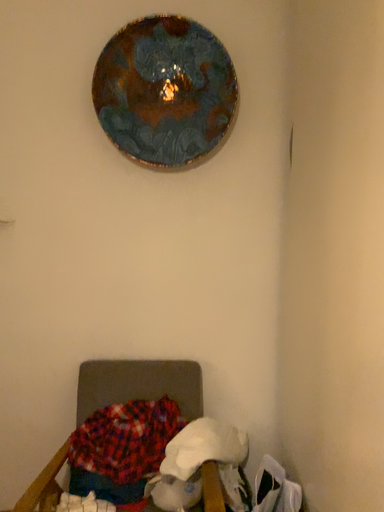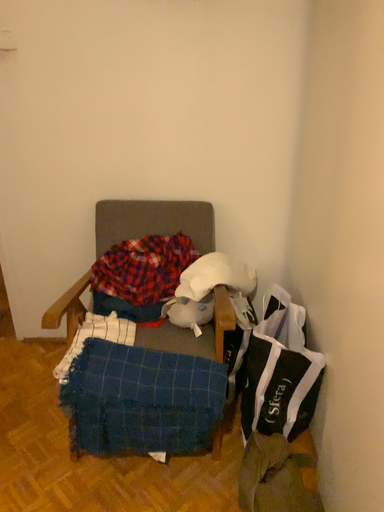
Question: Which way did the camera rotate in the video?

Choices:
 (A) rotated downward
 (B) rotated upward

Answer: (A)